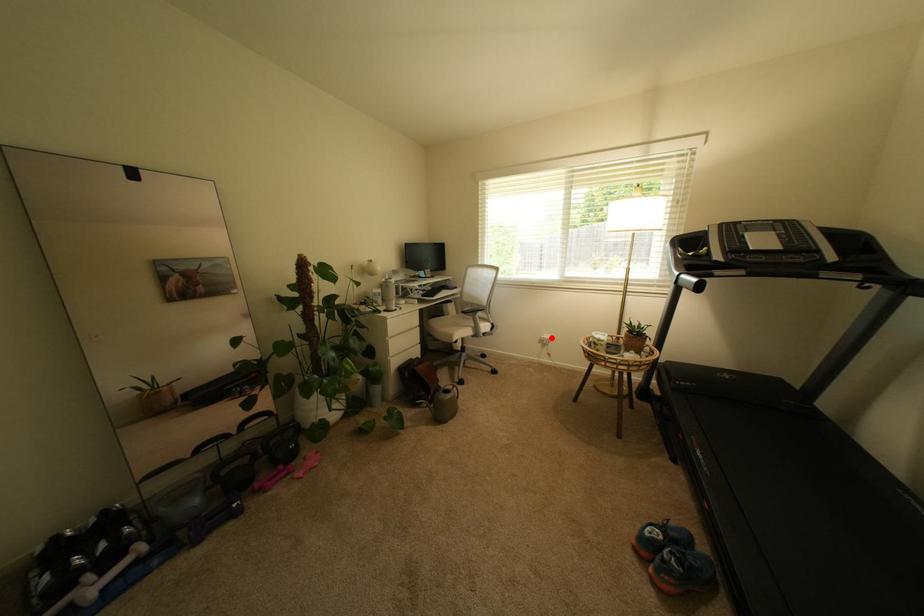
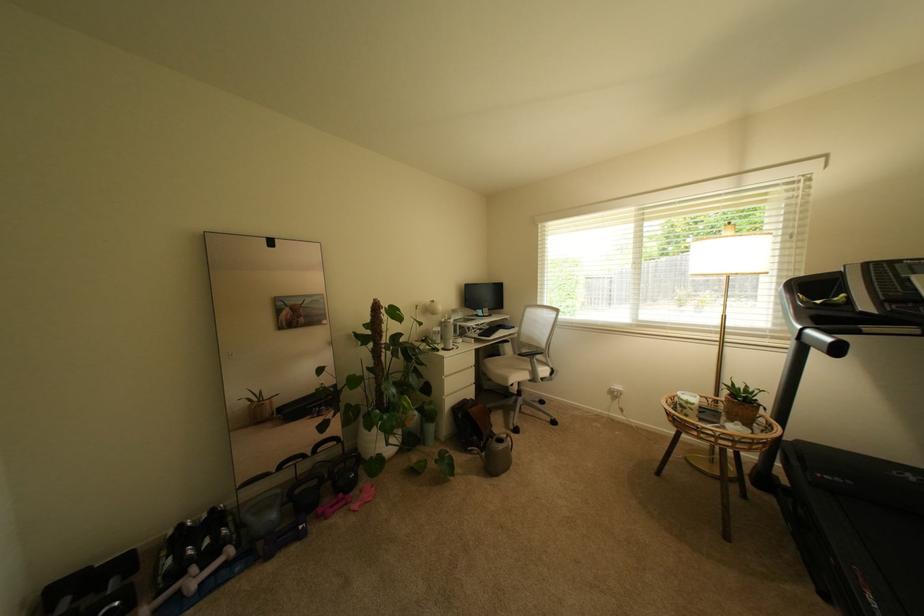
In the second image, find the point that corresponds to the highlighted location in the first image.

(622, 389)